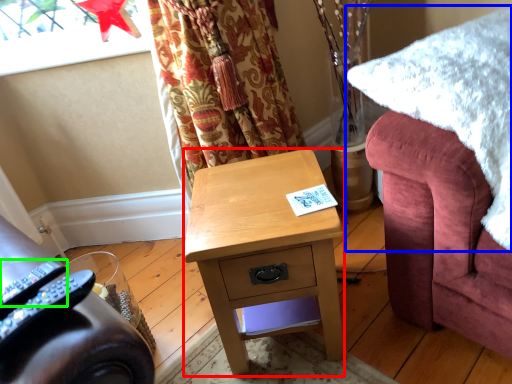
Question: Which is farther away from desk (highlighted by a red box)? blanket (highlighted by a blue box) or remote control (highlighted by a green box)?

Choices:
 (A) blanket
 (B) remote control

Answer: (B)